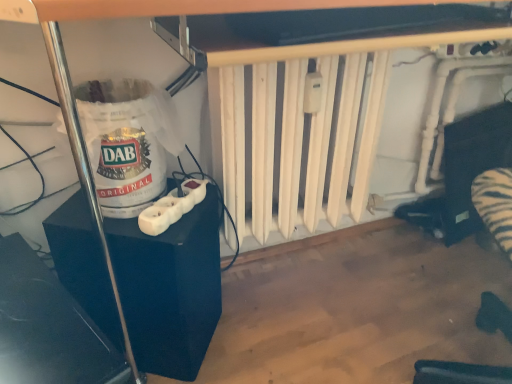
Locate an element on the screen. This screenshot has width=512, height=384. vacant space that is to the left of white plastic wii controller at lower left is located at coordinates (98, 223).